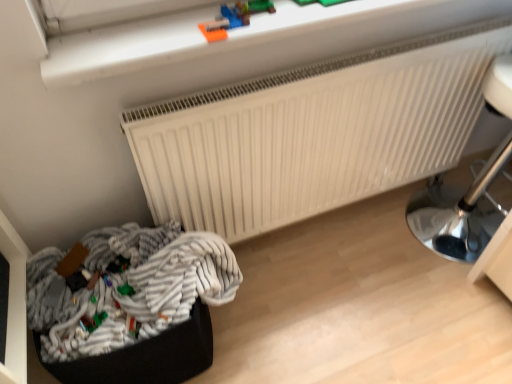
Describe the element at coordinates (92, 321) in the screenshot. The image size is (512, 384). I see `green plastic toy at lower left, the 3th toy positioned from the right` at that location.

Identify the location of green plastic toy at lower left, which ranks as the first toy in left-to-right order. (92, 321).

The height and width of the screenshot is (384, 512). Describe the element at coordinates (126, 290) in the screenshot. I see `green matte toy at lower left, the second toy from the top` at that location.

What do you see at coordinates (313, 133) in the screenshot? I see `white matte radiator at upper center` at bounding box center [313, 133].

Find the location of a particular element. This screenshot has height=384, width=512. metallic silver lamp at right is located at coordinates (458, 212).

The height and width of the screenshot is (384, 512). Identify the location of striped fabric laundry at lower left. (130, 285).

Image resolution: width=512 pixels, height=384 pixels. In order to click on green plastic toy at lower left, the first toy when ordered from bottom to top in this screenshot , I will do `click(92, 321)`.

Based on their positions, is smooth plastic toy at upper center, the first toy viewed from the right, located to the left or right of green matte toy at lower left, the second toy from the top?

In the image, smooth plastic toy at upper center, the first toy viewed from the right, appears on the right side of green matte toy at lower left, the second toy from the top.

Which is behind, point (228, 24) or point (120, 287)?

The point (120, 287) is more distant.

Could metallic silver lamp at right be considered to be inside green matte toy at lower left, which is the second toy from right to left?

Actually, metallic silver lamp at right is outside green matte toy at lower left, which is the second toy from right to left.

From a real-world perspective, which is physically above, green matte toy at lower left, the second toy ordered from the bottom, or metallic silver lamp at right?

In real-world perspective, green matte toy at lower left, the second toy ordered from the bottom, is above.

From the image's perspective, does green matte toy at lower left, the second toy ordered from the bottom, appear higher than metallic silver lamp at right?

No, from the image's perspective, green matte toy at lower left, the second toy ordered from the bottom, is not above metallic silver lamp at right.

Is green matte toy at lower left, which is counted as the second toy, starting from the left, to the right of metallic silver lamp at right from the viewer's perspective?

No, green matte toy at lower left, which is counted as the second toy, starting from the left, is not to the right of metallic silver lamp at right.

Is metallic silver lamp at right facing towards white matte radiator at upper center?

Yes, metallic silver lamp at right faces towards white matte radiator at upper center.

Can you confirm if metallic silver lamp at right is bigger than white matte radiator at upper center?

Yes.

Can you confirm if metallic silver lamp at right is wider than white matte radiator at upper center?

Yes.

From the image's perspective, between metallic silver lamp at right and white matte radiator at upper center, which one is located above?

white matte radiator at upper center, from the image's perspective.

Which of these two, metallic silver lamp at right or green plastic toy at lower left, which ranks as the first toy in left-to-right order, is thinner?

green plastic toy at lower left, which ranks as the first toy in left-to-right order, is thinner.

Between metallic silver lamp at right and green plastic toy at lower left, the first toy when ordered from bottom to top, which one has smaller size?

With smaller size is green plastic toy at lower left, the first toy when ordered from bottom to top.

Is metallic silver lamp at right facing away from green plastic toy at lower left, the first toy when ordered from bottom to top?

metallic silver lamp at right does not have its back to green plastic toy at lower left, the first toy when ordered from bottom to top.

Looking at this image, is metallic silver lamp at right further to camera compared to green plastic toy at lower left, which ranks as the first toy in left-to-right order?

Yes, it is.

From the image's perspective, is metallic silver lamp at right below green matte toy at lower left, the second toy ordered from the bottom?

Actually, metallic silver lamp at right appears above green matte toy at lower left, the second toy ordered from the bottom, in the image.

Between metallic silver lamp at right and green matte toy at lower left, the second toy from the top, which one has larger size?

metallic silver lamp at right.

From the picture: Is metallic silver lamp at right in front of or behind green matte toy at lower left, the second toy from the top, in the image?

Visually, metallic silver lamp at right is located in front of green matte toy at lower left, the second toy from the top.

From a real-world perspective, is smooth plastic toy at upper center, the 3th toy when ordered from bottom to top, physically located above or below green plastic toy at lower left, arranged as the 3th toy when viewed from the top?

From a real-world perspective, smooth plastic toy at upper center, the 3th toy when ordered from bottom to top, is physically above green plastic toy at lower left, arranged as the 3th toy when viewed from the top.

Is point (211, 32) farther from camera compared to point (87, 317)?

That is False.

Is smooth plastic toy at upper center, the 3th toy when ordered from bottom to top, touching green plastic toy at lower left, which ranks as the first toy in left-to-right order?

smooth plastic toy at upper center, the 3th toy when ordered from bottom to top, and green plastic toy at lower left, which ranks as the first toy in left-to-right order, are clearly separated.

Is green plastic toy at lower left, the first toy when ordered from bottom to top, at the back of smooth plastic toy at upper center, which is the 3th toy from left to right?

smooth plastic toy at upper center, which is the 3th toy from left to right, is not turned away from green plastic toy at lower left, the first toy when ordered from bottom to top.

From a real-world perspective, is green matte toy at lower left, which is counted as the second toy, starting from the left, located beneath smooth plastic toy at upper center, the first toy viewed from the right?

Yes, from a real-world perspective, green matte toy at lower left, which is counted as the second toy, starting from the left, is under smooth plastic toy at upper center, the first toy viewed from the right.

Is green matte toy at lower left, which is counted as the second toy, starting from the left, positioned with its back to smooth plastic toy at upper center, which ranks as the first toy in top-to-bottom order?

No, green matte toy at lower left, which is counted as the second toy, starting from the left, is not facing away from smooth plastic toy at upper center, which ranks as the first toy in top-to-bottom order.

Consider the image. Which is closer, (x=124, y=291) or (x=206, y=31)?

Point (x=124, y=291) appears to be farther away from the viewer than point (x=206, y=31).

Can you confirm if green matte toy at lower left, which is the second toy from right to left, is bigger than smooth plastic toy at upper center, the first toy viewed from the right?

Actually, green matte toy at lower left, which is the second toy from right to left, might be smaller than smooth plastic toy at upper center, the first toy viewed from the right.

You are a GUI agent. You are given a task and a screenshot of the screen. Output one action in this format:
    pyautogui.click(x=<x>, y=<y>)
    Task: Click on the toy that is the 1st one below the smooth plastic toy at upper center, the 3th toy when ordered from bottom to top (from a real-world perspective)
    
    Given the screenshot: What is the action you would take?
    pyautogui.click(x=126, y=290)

From the image's perspective, count 1st toys downward from the metallic silver lamp at right and point to it. Please provide its 2D coordinates.

[(126, 290)]

When comparing their distances from white matte radiator at upper center, does striped fabric laundry at lower left or green plastic toy at lower left, the 3th toy positioned from the right, seem closer?

striped fabric laundry at lower left lies closer to white matte radiator at upper center than the other object.

From the picture: From the image, which object appears to be nearer to metallic silver lamp at right, white matte radiator at upper center or green plastic toy at lower left, the 3th toy positioned from the right?

Among the two, white matte radiator at upper center is located nearer to metallic silver lamp at right.

Based on their spatial positions, is green plastic toy at lower left, the first toy when ordered from bottom to top, or green matte toy at lower left, the second toy from the top, closer to smooth plastic toy at upper center, the 3th toy when ordered from bottom to top?

The object closer to smooth plastic toy at upper center, the 3th toy when ordered from bottom to top, is green matte toy at lower left, the second toy from the top.

In the scene shown: Based on their spatial positions, is green plastic toy at lower left, arranged as the 3th toy when viewed from the top, or striped fabric laundry at lower left further from metallic silver lamp at right?

green plastic toy at lower left, arranged as the 3th toy when viewed from the top, is further to metallic silver lamp at right.

Estimate the real-world distances between objects in this image. Which object is further from smooth plastic toy at upper center, the 3th toy when ordered from bottom to top, white matte radiator at upper center or striped fabric laundry at lower left?

The object further to smooth plastic toy at upper center, the 3th toy when ordered from bottom to top, is striped fabric laundry at lower left.

When comparing their distances from striped fabric laundry at lower left, does green matte toy at lower left, the second toy from the top, or metallic silver lamp at right seem closer?

green matte toy at lower left, the second toy from the top, lies closer to striped fabric laundry at lower left than the other object.

Estimate the real-world distances between objects in this image. Which object is further from green matte toy at lower left, the second toy ordered from the bottom, metallic silver lamp at right or white matte radiator at upper center?

Based on the image, metallic silver lamp at right appears to be further to green matte toy at lower left, the second toy ordered from the bottom.

Based on their spatial positions, is smooth plastic toy at upper center, which is the 3th toy from left to right, or green plastic toy at lower left, the 3th toy positioned from the right, further from green matte toy at lower left, the second toy from the top?

Among the two, smooth plastic toy at upper center, which is the 3th toy from left to right, is located further to green matte toy at lower left, the second toy from the top.

Locate an element on the screen. The height and width of the screenshot is (384, 512). laundry between green matte toy at lower left, the second toy ordered from the bottom, and metallic silver lamp at right is located at coordinates (130, 285).

Image resolution: width=512 pixels, height=384 pixels. I want to click on radiator between smooth plastic toy at upper center, which is the 3th toy from left to right, and green plastic toy at lower left, arranged as the 3th toy when viewed from the top, in the vertical direction, so click(313, 133).

Where is `toy situated between green matte toy at lower left, the second toy ordered from the bottom, and metallic silver lamp at right from left to right`? The width and height of the screenshot is (512, 384). toy situated between green matte toy at lower left, the second toy ordered from the bottom, and metallic silver lamp at right from left to right is located at coordinates (234, 18).

You are a GUI agent. You are given a task and a screenshot of the screen. Output one action in this format:
    pyautogui.click(x=<x>, y=<y>)
    Task: Click on the radiator that lies between smooth plastic toy at upper center, the first toy viewed from the right, and striped fabric laundry at lower left from top to bottom
    
    Given the screenshot: What is the action you would take?
    313,133